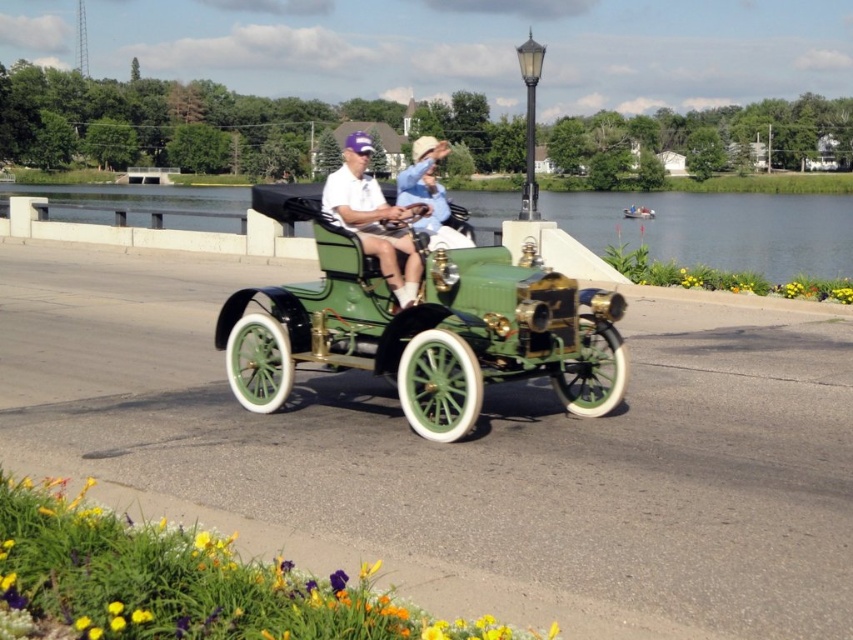
You are a photographer planning to take a picture of the green matte vintage car at center. The camera you are using has a focal length of 50mm and an aperture of f2.8. What is the minimum distance you need to be from the car to ensure it fits entirely within the frame?

The position of the green matte vintage car at center is at point (422, 326). However, without additional information about the car dimensions or the camera sensor size, it is impossible to calculate the exact minimum distance required for the car to fit within the frame.

You are standing at point (x=422, y=326) in the image. What object is located exactly at this point?

The green matte vintage car at center is located exactly at point (x=422, y=326).

You are a pedestrian standing on the side of the road. You see the green matte vintage car at center and the matte green hat at center. Which object is closer to you?

The green matte vintage car at center is closer to you because it is in front of the matte green hat at center.